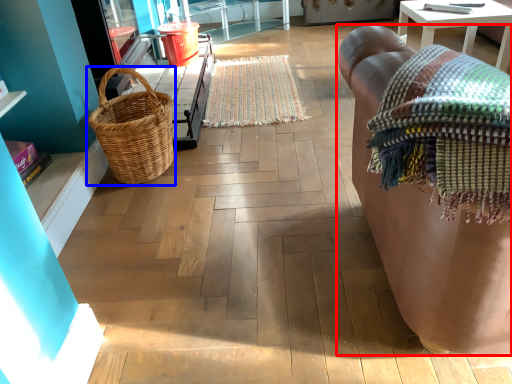
Question: Which point is further to the camera, studio couch (highlighted by a red box) or picnic basket (highlighted by a blue box)?

Choices:
 (A) studio couch
 (B) picnic basket

Answer: (B)